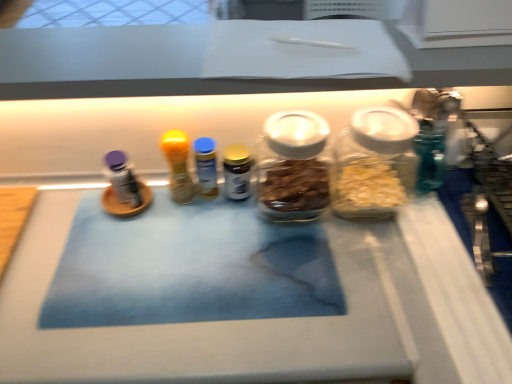
The height and width of the screenshot is (384, 512). I want to click on free space that is to the left of yellow matte bottle at center, marked as the 1th bottle in a left-to-right arrangement, so click(71, 223).